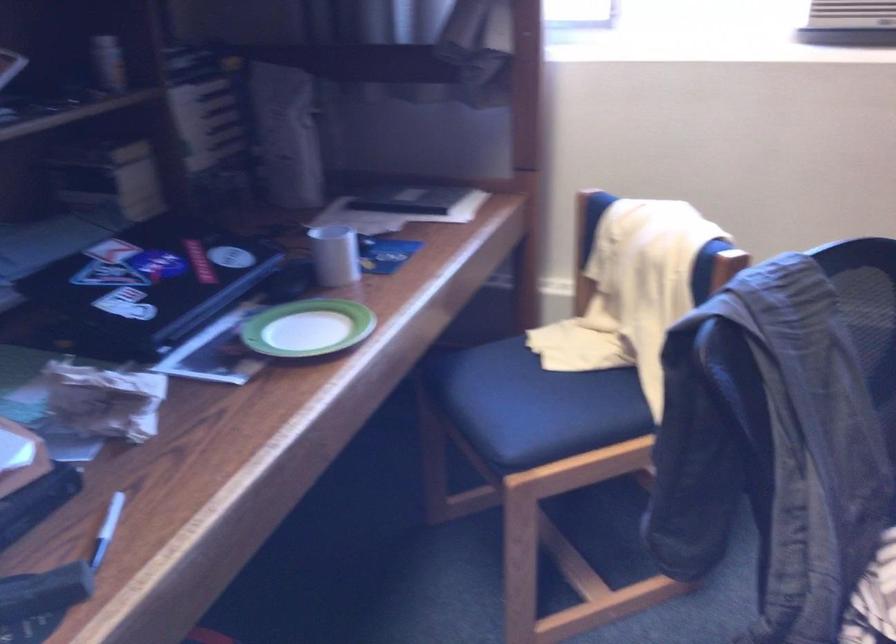
Which object does [107,529] point to?

It refers to a white and blue pen.